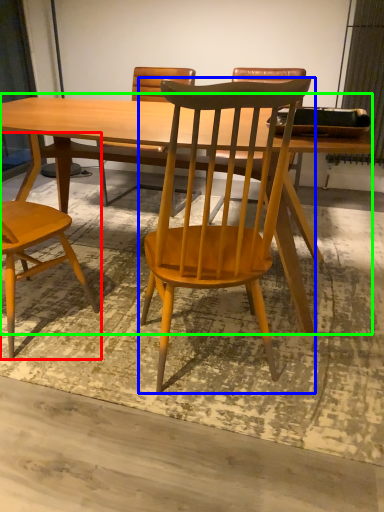
Question: Considering the real-world distances, which object is closest to chair (highlighted by a red box)? chair (highlighted by a blue box) or table (highlighted by a green box).

Choices:
 (A) chair
 (B) table

Answer: (B)